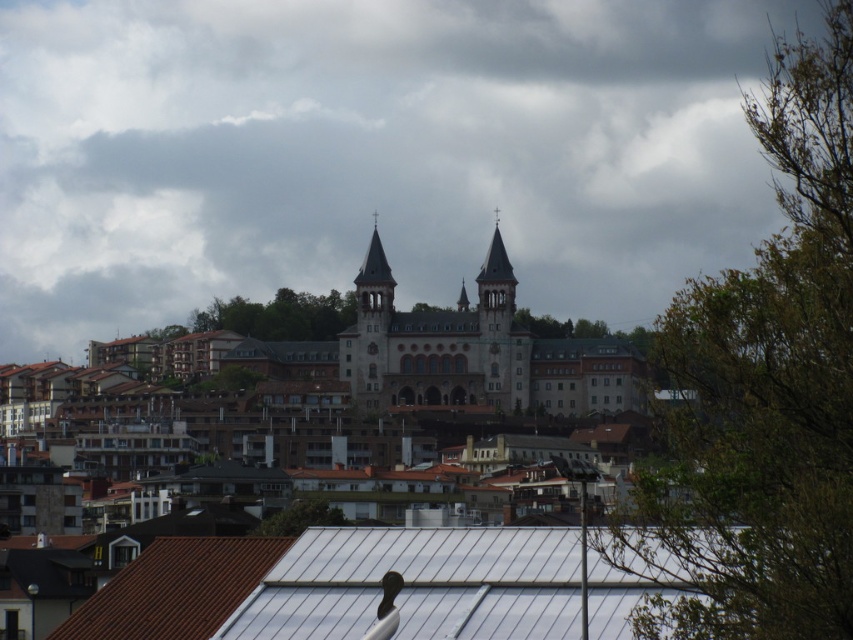
Can you confirm if dark gray stone church at center is positioned to the left of smooth stone spire at center?

Correct, you'll find dark gray stone church at center to the left of smooth stone spire at center.

Which is behind, point (437, 369) or point (460, 292)?

The point (460, 292) is more distant.

Image resolution: width=853 pixels, height=640 pixels. Describe the element at coordinates (434, 340) in the screenshot. I see `dark gray stone church at center` at that location.

Where is `dark gray stone church at center`? dark gray stone church at center is located at coordinates (434, 340).

Is brown corrugated roof at lower left bigger than smooth stone spire at center?

Yes.

Is brown corrugated roof at lower left to the right of smooth stone spire at center from the viewer's perspective?

In fact, brown corrugated roof at lower left is to the left of smooth stone spire at center.

Is point (169, 620) positioned in front of point (457, 301)?

Yes, point (169, 620) is in front of point (457, 301).

Image resolution: width=853 pixels, height=640 pixels. I want to click on brown corrugated roof at lower left, so click(x=175, y=589).

Identify the location of dark gray stone church at center. (434, 340).

Which is above, dark gray stone church at center or brown stone tower at center?

Positioned higher is brown stone tower at center.

Locate an element on the screen. dark gray stone church at center is located at coordinates (434, 340).